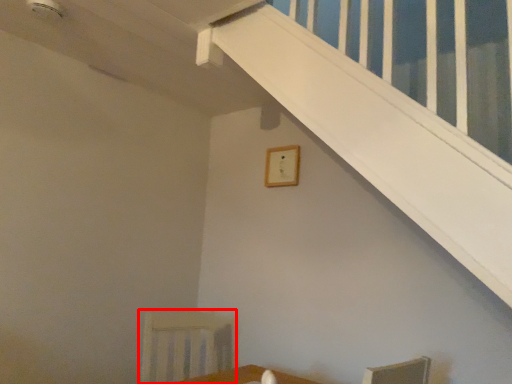
Question: Observing the image, what is the correct spatial positioning of armchair (annotated by the red box) in reference to picture frame?

Choices:
 (A) left
 (B) right

Answer: (A)